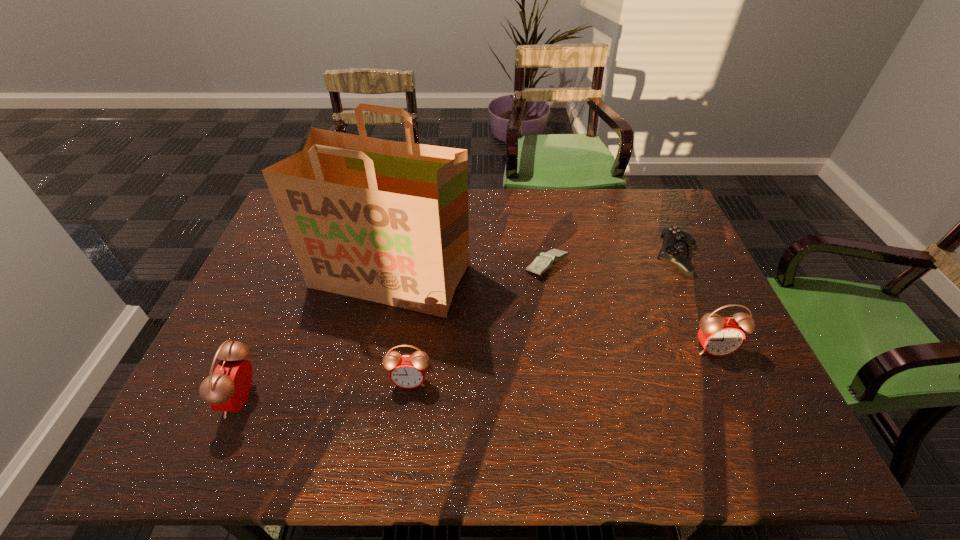
Image resolution: width=960 pixels, height=540 pixels. I want to click on free space located on the clock face of the leftmost alarm clock, so click(x=198, y=399).

The height and width of the screenshot is (540, 960). In order to click on vacant space located on the clock face of the fourth tallest object in this screenshot , I will do `click(406, 410)`.

The width and height of the screenshot is (960, 540). I want to click on free space located 0.130m on the front of the second shortest object, so click(x=702, y=313).

Locate an element on the screen. This screenshot has height=540, width=960. blank space located on the back of the tallest object is located at coordinates (402, 217).

Find the location of `vacant space situated 0.050m on the front of the third object from right to left`. vacant space situated 0.050m on the front of the third object from right to left is located at coordinates (552, 294).

At what (x,y) coordinates should I click in order to perform the action: click on object present at the left edge. Please return your answer as a coordinate pair (x, y). Looking at the image, I should click on (227, 389).

The image size is (960, 540). Identify the location of alarm clock present at the right edge. (719, 336).

Locate an element on the screen. The height and width of the screenshot is (540, 960). control positioned at the right edge is located at coordinates (675, 241).

Where is `object at the near left corner`? The height and width of the screenshot is (540, 960). object at the near left corner is located at coordinates (227, 389).

At what (x,y) coordinates should I click in order to perform the action: click on free region at the far edge. Please return your answer as a coordinate pair (x, y). Looking at the image, I should click on (598, 188).